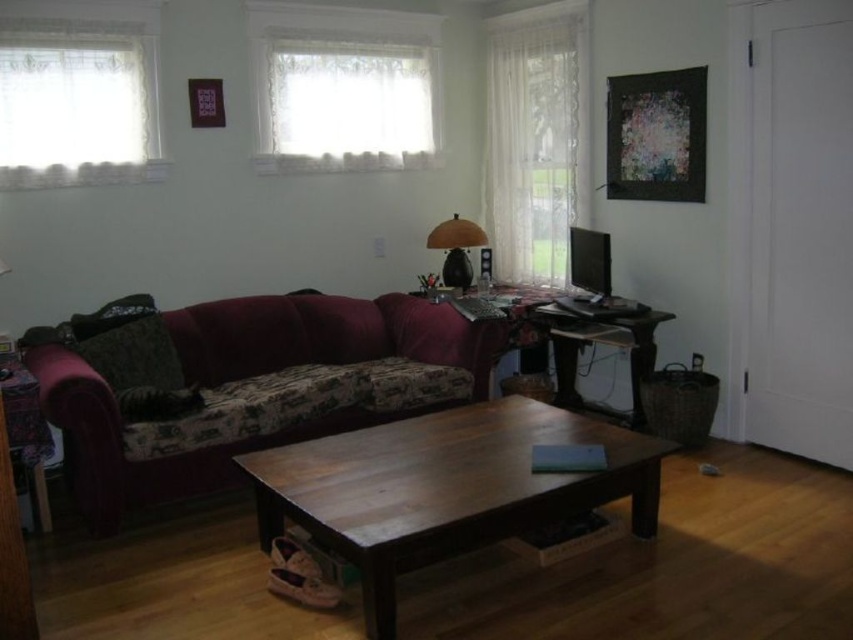
Question: Observing the image, what is the correct spatial positioning of white sheer curtain at upper center in reference to wooden desk at center?

Choices:
 (A) right
 (B) left

Answer: (B)

Question: Which object is the closest to the velvet fabric couch at left?

Choices:
 (A) wooden desk at center
 (B) matte brown lamp at center
 (C) wooden coffee table at center
 (D) white sheer curtain at upper center

Answer: (C)

Question: Is white sheer curtain at upper left to the left of white lace curtain at upper right from the viewer's perspective?

Choices:
 (A) no
 (B) yes

Answer: (B)

Question: Among these points, which one is farthest from the camera?

Choices:
 (A) (584, 177)
 (B) (534, 401)
 (C) (115, 500)

Answer: (A)

Question: Does wooden coffee table at center come in front of white sheer curtain at upper center?

Choices:
 (A) yes
 (B) no

Answer: (A)

Question: Which point appears closest to the camera in this image?

Choices:
 (A) (368, 80)
 (B) (454, 516)
 (C) (440, 221)
 (D) (100, 492)

Answer: (B)